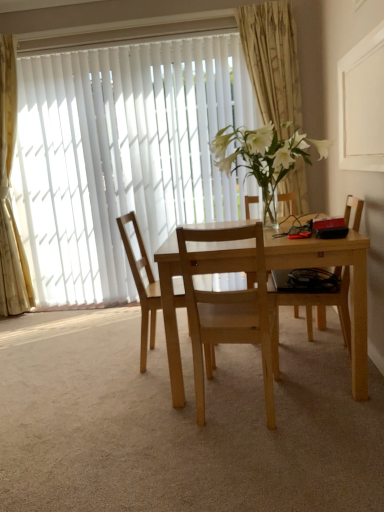
Question: From the image's perspective, is gold textured curtain at upper center, marked as the first curtain in a right-to-left arrangement, over white vertical blinds at upper left?

Choices:
 (A) yes
 (B) no

Answer: (A)

Question: From a real-world perspective, is gold textured curtain at upper center, marked as the 2th curtain in a left-to-right arrangement, located beneath white vertical blinds at upper left?

Choices:
 (A) no
 (B) yes

Answer: (A)

Question: Is gold textured curtain at upper center, marked as the 2th curtain in a left-to-right arrangement, completely or partially outside of white vertical blinds at upper left?

Choices:
 (A) no
 (B) yes

Answer: (B)

Question: From the image's perspective, is gold textured curtain at upper center, marked as the first curtain in a right-to-left arrangement, located beneath white vertical blinds at upper left?

Choices:
 (A) yes
 (B) no

Answer: (B)

Question: Is gold textured curtain at upper center, marked as the first curtain in a right-to-left arrangement, positioned before white vertical blinds at upper left?

Choices:
 (A) no
 (B) yes

Answer: (B)

Question: Do you think light wood chair at right, placed as the 3th chair when sorted from left to right, is within white vertical blinds at upper left, or outside of it?

Choices:
 (A) inside
 (B) outside

Answer: (B)

Question: From a real-world perspective, is light wood chair at right, placed as the 3th chair when sorted from left to right, physically located above or below white vertical blinds at upper left?

Choices:
 (A) above
 (B) below

Answer: (B)

Question: In terms of height, does light wood chair at right, the 1th chair viewed from the right, look taller or shorter compared to white vertical blinds at upper left?

Choices:
 (A) tall
 (B) short

Answer: (B)

Question: Based on their positions, is light wood chair at right, the 1th chair viewed from the right, located to the left or right of white vertical blinds at upper left?

Choices:
 (A) right
 (B) left

Answer: (A)

Question: From the image's perspective, is light wood table at center located above or below gold textured curtain at upper center, marked as the first curtain in a right-to-left arrangement?

Choices:
 (A) below
 (B) above

Answer: (A)

Question: Relative to gold textured curtain at upper center, marked as the 2th curtain in a left-to-right arrangement, is light wood table at center in front or behind?

Choices:
 (A) behind
 (B) front

Answer: (B)

Question: Looking at the image, does light wood table at center seem bigger or smaller compared to gold textured curtain at upper center, marked as the first curtain in a right-to-left arrangement?

Choices:
 (A) big
 (B) small

Answer: (A)

Question: Do you think light wood table at center is within gold textured curtain at upper center, marked as the first curtain in a right-to-left arrangement, or outside of it?

Choices:
 (A) outside
 (B) inside

Answer: (A)

Question: Visually, is white vertical blinds at upper left positioned to the left or to the right of light wood table at center?

Choices:
 (A) left
 (B) right

Answer: (A)

Question: Considering the positions of white vertical blinds at upper left and light wood table at center in the image, is white vertical blinds at upper left bigger or smaller than light wood table at center?

Choices:
 (A) big
 (B) small

Answer: (B)